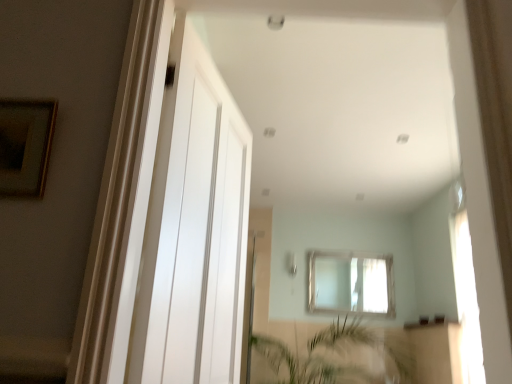
Question: In terms of height, does green leafy plant at lower center look taller or shorter compared to white glossy door at center?

Choices:
 (A) tall
 (B) short

Answer: (B)

Question: From a real-world perspective, is green leafy plant at lower center above or below white glossy door at center?

Choices:
 (A) below
 (B) above

Answer: (A)

Question: Which object is the closest to the wooden framed picture at upper left?

Choices:
 (A) green leafy plant at lower center
 (B) clear glass window at center
 (C) black glass window sill at lower center
 (D) white glossy door at center

Answer: (D)

Question: Which is nearer to the green leafy plant at lower center?

Choices:
 (A) clear glass window at center
 (B) black glass window sill at lower center
 (C) white glossy door at center
 (D) wooden framed picture at upper left

Answer: (A)